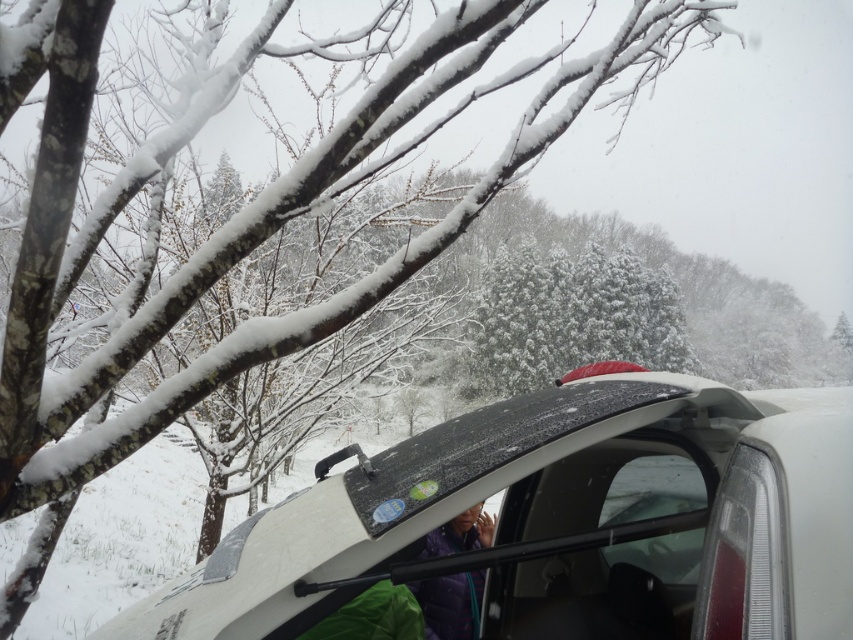
Between snow-covered evergreen at center and purple fabric at lower center, which one appears on the left side from the viewer's perspective?

purple fabric at lower center is more to the left.

Is snow-covered evergreen at center above purple fabric at lower center?

Yes.

Locate an element on the screen. This screenshot has width=853, height=640. snow-covered evergreen at center is located at coordinates (572, 317).

Which of these two, white glossy car at lower right or purple fabric at lower center, stands taller?

white glossy car at lower right is taller.

Is white glossy car at lower right thinner than purple fabric at lower center?

In fact, white glossy car at lower right might be wider than purple fabric at lower center.

Is point (653, 408) farther from viewer compared to point (461, 600)?

No, (653, 408) is closer to viewer.

At what (x,y) coordinates should I click in order to perform the action: click on white glossy car at lower right. Please return your answer as a coordinate pair (x, y). The image size is (853, 640). Looking at the image, I should click on (560, 522).

Which is more to the right, white glossy car at lower right or snow-covered evergreen at center?

snow-covered evergreen at center is more to the right.

Can you confirm if white glossy car at lower right is positioned to the right of snow-covered evergreen at center?

No, white glossy car at lower right is not to the right of snow-covered evergreen at center.

The image size is (853, 640). Describe the element at coordinates (560, 522) in the screenshot. I see `white glossy car at lower right` at that location.

Locate an element on the screen. The width and height of the screenshot is (853, 640). white glossy car at lower right is located at coordinates (560, 522).